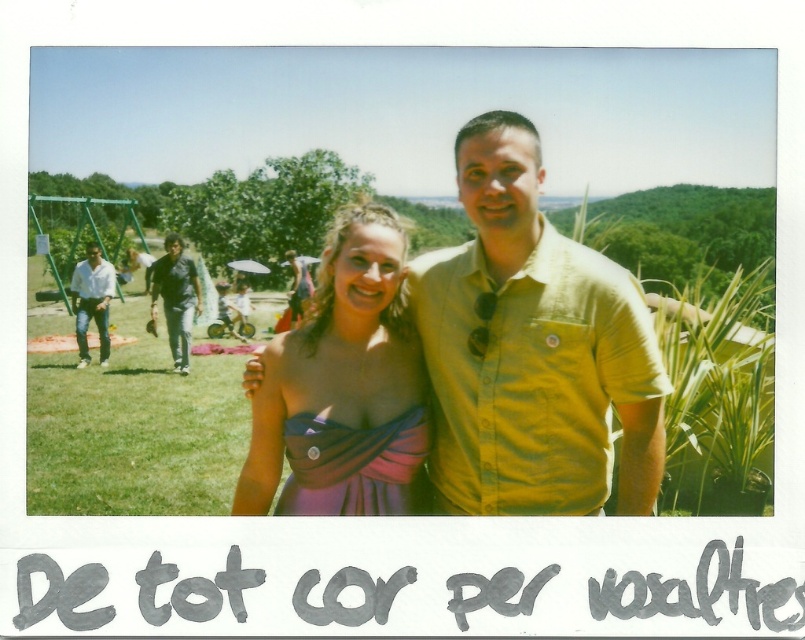
Question: Observing the image, what is the correct spatial positioning of yellow cotton shirt at center in reference to dark blue jeans at left?

Choices:
 (A) below
 (B) above

Answer: (B)

Question: Estimate the real-world distances between objects in this image. Which object is farther from the matte black dress at center?

Choices:
 (A) dark blue jeans at left
 (B) yellow cotton shirt at center

Answer: (B)

Question: Which point is farther from the camera taking this photo?

Choices:
 (A) (283, 253)
 (B) (108, 288)
 (C) (624, 376)
 (D) (192, 276)

Answer: (A)

Question: Is yellow cotton shirt at center positioned behind dark blue jeans at left?

Choices:
 (A) no
 (B) yes

Answer: (A)

Question: Which of the following is the closest to the observer?

Choices:
 (A) (502, 115)
 (B) (161, 268)
 (C) (369, 209)
 (D) (79, 296)

Answer: (A)

Question: Can you confirm if yellow cotton shirt at center is positioned to the right of dark blue jeans at left?

Choices:
 (A) no
 (B) yes

Answer: (B)